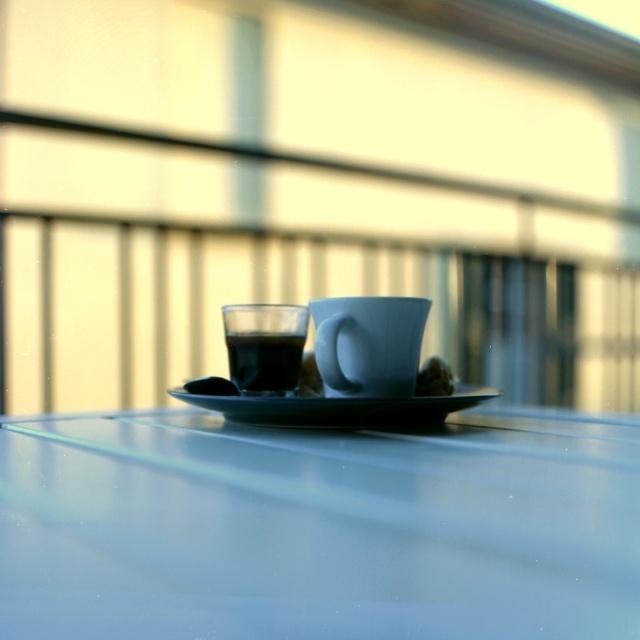
Question: Which point is farther to the camera?

Choices:
 (A) satin brown sugar cube at center
 (B) smooth brown cookie at center

Answer: (A)

Question: Among these points, which one is farthest from the camera?

Choices:
 (A) (355, 412)
 (B) (316, 376)
 (C) (422, 376)
 (D) (3, 524)

Answer: (B)

Question: Which object is farther from the camera taking this photo?

Choices:
 (A) satin brown sugar cube at center
 (B) glossy glass table at center
 (C) black glossy saucer at center
 (D) smooth brown cookie at center

Answer: (A)

Question: Can you confirm if matte ceramic cup at center is thinner than satin brown sugar cube at center?

Choices:
 (A) no
 (B) yes

Answer: (A)

Question: Does matte ceramic cup at center appear on the left side of black glass at center?

Choices:
 (A) yes
 (B) no

Answer: (B)

Question: Does matte ceramic cup at center come in front of black glossy saucer at center?

Choices:
 (A) no
 (B) yes

Answer: (A)